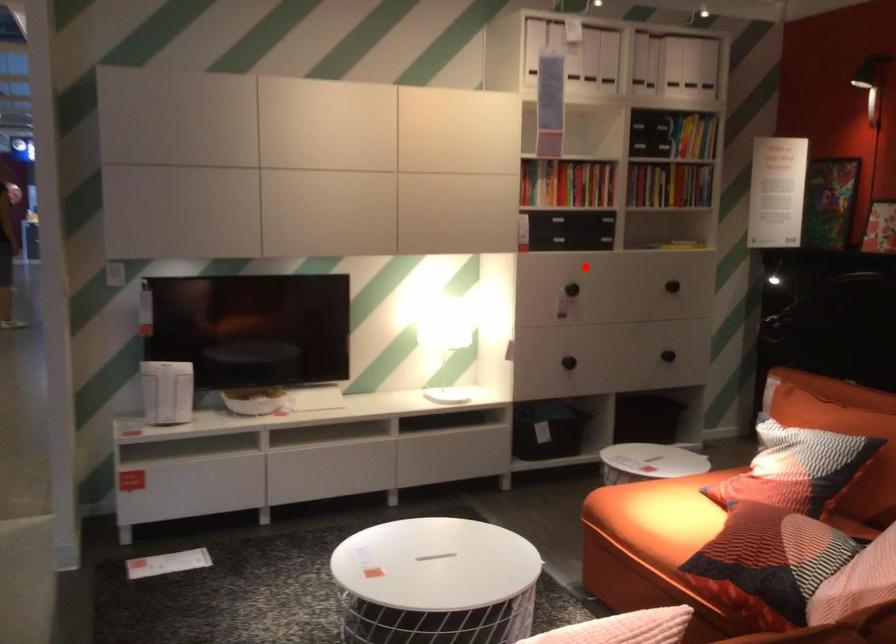
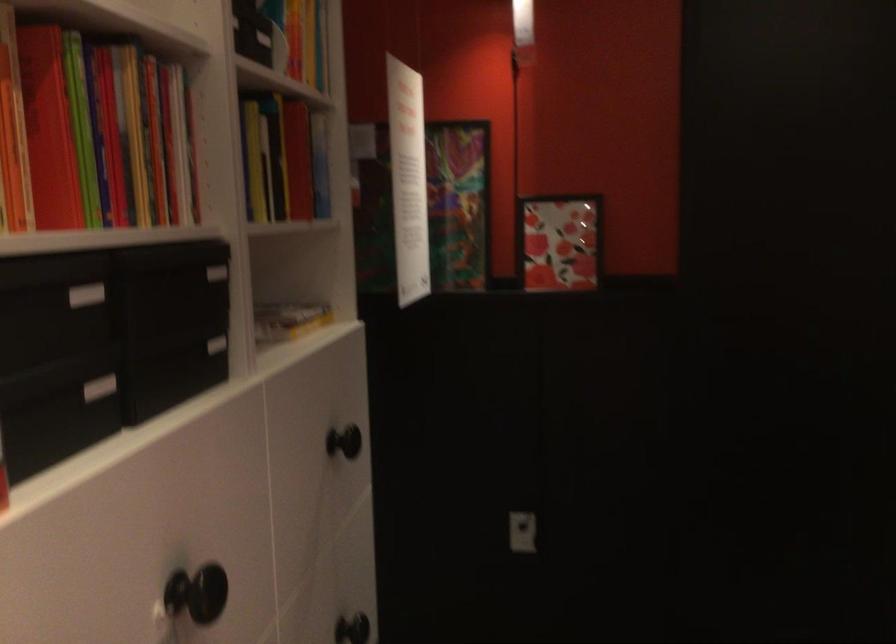
Question: I am providing you with two images of the same scene from different viewpoints. Image1 has a red point marked. In image2, the corresponding 3D location appears at what relative position? Reply with the corresponding letter.

Choices:
 (A) Closer
 (B) Farther

Answer: (A)